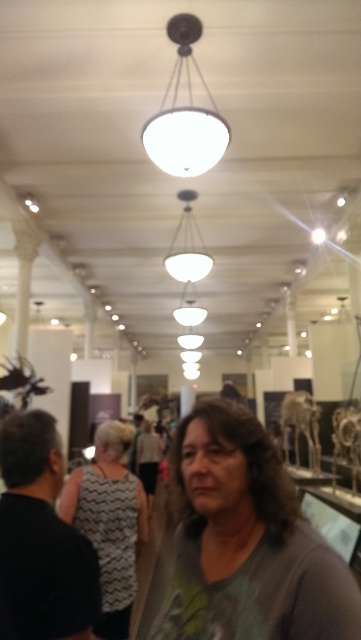
Does gray zigzag dress at center have a greater height compared to white matte light fixture at upper center?

Indeed, gray zigzag dress at center has a greater height compared to white matte light fixture at upper center.

Is gray zigzag dress at center to the left of white matte light fixture at upper center from the viewer's perspective?

Correct, you'll find gray zigzag dress at center to the left of white matte light fixture at upper center.

Is point (103, 589) positioned behind point (210, 102)?

No, it is in front of (210, 102).

Where is `gray zigzag dress at center`? The width and height of the screenshot is (361, 640). gray zigzag dress at center is located at coordinates (109, 522).

Is point (246, 522) less distant than point (184, 29)?

Yes, it is in front of point (184, 29).

Which of these two, gray fabric at center or white matte light fixture at upper center, stands shorter?

Standing shorter between the two is white matte light fixture at upper center.

The image size is (361, 640). What are the coordinates of `gray fabric at center` in the screenshot? It's located at (241, 544).

You are a GUI agent. You are given a task and a screenshot of the screen. Output one action in this format:
    pyautogui.click(x=<x>, y=<y>)
    Task: Click on the gray fabric at center
    Image resolution: width=361 pixels, height=640 pixels.
    Given the screenshot: What is the action you would take?
    pyautogui.click(x=241, y=544)

Between gray fabric at center and gray zigzag dress at center, which one is positioned higher?

Positioned higher is gray zigzag dress at center.

From the picture: Is gray fabric at center smaller than gray zigzag dress at center?

Indeed, gray fabric at center has a smaller size compared to gray zigzag dress at center.

Which is in front, point (310, 636) or point (77, 472)?

Point (310, 636)

Find the location of a particular element. This screenshot has width=361, height=640. gray fabric at center is located at coordinates pyautogui.click(x=241, y=544).